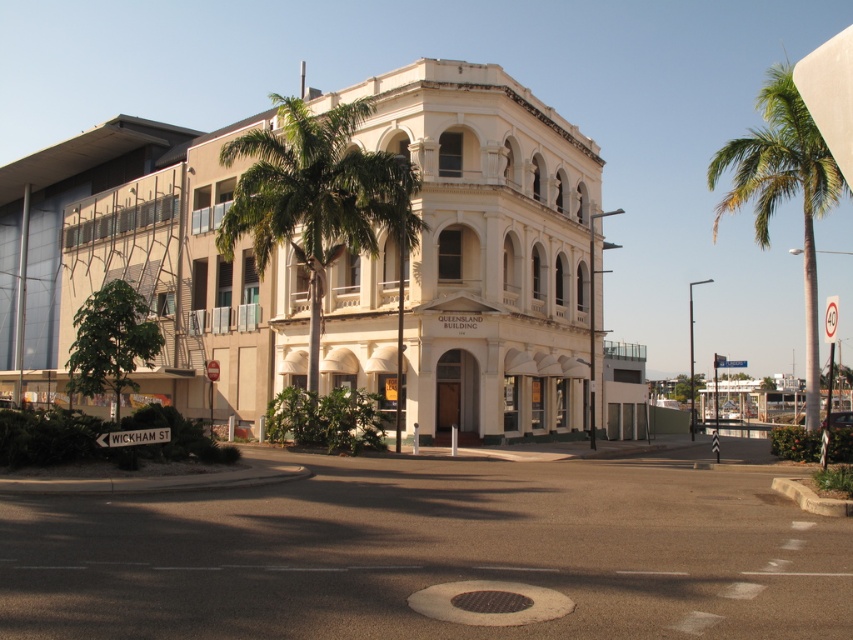
Question: Does green leafy palm tree at center appear over white plastic street sign at lower left?

Choices:
 (A) no
 (B) yes

Answer: (B)

Question: Which point appears farthest from the camera in this image?

Choices:
 (A) (782, 156)
 (B) (370, 211)

Answer: (B)

Question: In this image, where is green leafy palm tree at right located relative to white plastic street sign at lower left?

Choices:
 (A) left
 (B) right

Answer: (B)

Question: Does green leafy palm tree at right lie in front of white plastic street sign at lower left?

Choices:
 (A) yes
 (B) no

Answer: (A)

Question: Which of the following is the closest to the observer?

Choices:
 (A) (614, 566)
 (B) (129, 444)
 (C) (380, 193)
 (D) (804, 236)

Answer: (A)

Question: Which point is closer to the camera taking this photo?

Choices:
 (A) (724, 161)
 (B) (120, 440)
 (C) (277, 148)
 (D) (279, 609)

Answer: (D)